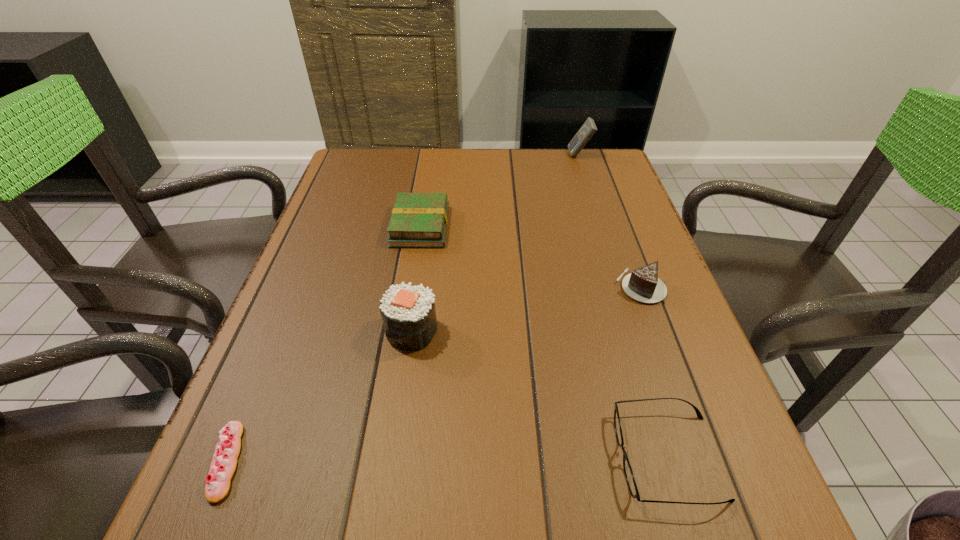
I want to click on vacant space at the far edge of the desktop, so click(442, 167).

Locate an element on the screen. This screenshot has width=960, height=540. free region at the left edge of the desktop is located at coordinates (327, 206).

Locate an element on the screen. Image resolution: width=960 pixels, height=540 pixels. blank space at the right edge is located at coordinates (631, 310).

In the image, there is a desktop. Identify the location of free space at the far right corner. (601, 175).

The image size is (960, 540). In order to click on free region at the near right corner of the desktop in this screenshot , I will do `click(728, 539)`.

The image size is (960, 540). I want to click on free spot between the fifth nearest object and the calculator, so click(x=500, y=191).

Identify the location of free space that is in between the eclair and the third farthest object. Image resolution: width=960 pixels, height=540 pixels. (434, 374).

Where is `vacant point located between the shortest object and the book`? This screenshot has width=960, height=540. vacant point located between the shortest object and the book is located at coordinates (324, 343).

At what (x,y) coordinates should I click in order to perform the action: click on free space that is in between the shortest object and the spectacles. Please return your answer as a coordinate pair (x, y). The width and height of the screenshot is (960, 540). Looking at the image, I should click on (447, 459).

The height and width of the screenshot is (540, 960). Find the location of `vacant area that lies between the fifth tallest object and the third farthest object`. vacant area that lies between the fifth tallest object and the third farthest object is located at coordinates (654, 372).